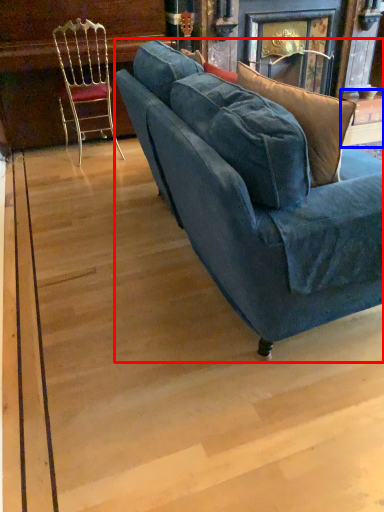
Question: Which object appears closest to the camera in this image, studio couch (highlighted by a red box) or table (highlighted by a blue box)?

Choices:
 (A) studio couch
 (B) table

Answer: (A)